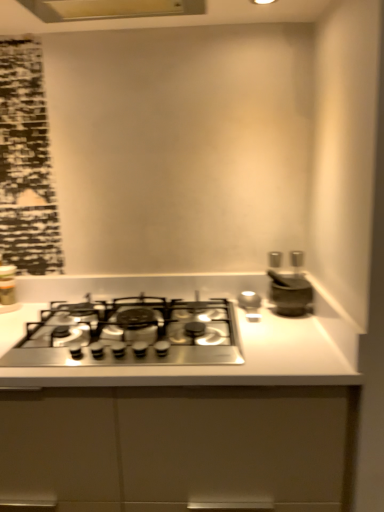
Describe the element at coordinates (110, 9) in the screenshot. I see `matte white exhaust hood at upper center` at that location.

This screenshot has height=512, width=384. What do you see at coordinates (130, 334) in the screenshot? I see `stainless steel gas stove at center` at bounding box center [130, 334].

Image resolution: width=384 pixels, height=512 pixels. What do you see at coordinates (291, 289) in the screenshot?
I see `satin silver mortar at right` at bounding box center [291, 289].

You are a GUI agent. You are given a task and a screenshot of the screen. Output one action in this format:
    pyautogui.click(x=<x>, y=<y>)
    Task: Click on the matte white exhaust hood at upper center
    
    Given the screenshot: What is the action you would take?
    pyautogui.click(x=110, y=9)

Is metallic silver canister at left wider or thinner than satin silver mortar at right?

metallic silver canister at left is thinner than satin silver mortar at right.

Which object is more forward, metallic silver canister at left or satin silver mortar at right?

satin silver mortar at right is closer to the camera.

Would you say metallic silver canister at left contains satin silver mortar at right?

No, satin silver mortar at right is not inside metallic silver canister at left.

Can you tell me how much metallic silver canister at left and satin silver mortar at right differ in facing direction?

The facing directions of metallic silver canister at left and satin silver mortar at right are 0.0382 degrees apart.

Is metallic silver canister at left with matte white exhaust hood at upper center?

They are not placed beside each other.

Can you tell me how much metallic silver canister at left and matte white exhaust hood at upper center differ in facing direction?

0.624 degrees.

Considering the relative sizes of metallic silver canister at left and matte white exhaust hood at upper center in the image provided, is metallic silver canister at left thinner than matte white exhaust hood at upper center?

Yes, metallic silver canister at left is thinner than matte white exhaust hood at upper center.

Is stainless steel gas stove at center in contact with matte white exhaust hood at upper center?

stainless steel gas stove at center is not next to matte white exhaust hood at upper center, and they're not touching.

Is matte white exhaust hood at upper center surrounded by stainless steel gas stove at center?

No, matte white exhaust hood at upper center is not a part of stainless steel gas stove at center.

How distant is stainless steel gas stove at center from matte white exhaust hood at upper center?

A distance of 3.43 feet exists between stainless steel gas stove at center and matte white exhaust hood at upper center.

From a real-world perspective, is stainless steel gas stove at center located beneath matte white exhaust hood at upper center?

Yes, from a real-world perspective, stainless steel gas stove at center is below matte white exhaust hood at upper center.

Does matte white exhaust hood at upper center have a lesser width compared to satin silver mortar at right?

No.

Which is behind, point (179, 6) or point (311, 301)?

The point (179, 6) is farther.

From the image's perspective, is matte white exhaust hood at upper center on satin silver mortar at right?

Correct, matte white exhaust hood at upper center appears higher than satin silver mortar at right in the image.

The height and width of the screenshot is (512, 384). Identify the location of exhaust hood located in front of the satin silver mortar at right. (110, 9).

Based on the photo, between stainless steel gas stove at center and metallic silver canister at left, which one has smaller size?

With smaller size is metallic silver canister at left.

Who is more distant, stainless steel gas stove at center or metallic silver canister at left?

metallic silver canister at left.

Which object is positioned more to the right, stainless steel gas stove at center or metallic silver canister at left?

stainless steel gas stove at center.

Consider the image. From a real-world perspective, which is physically above, stainless steel gas stove at center or metallic silver canister at left?

metallic silver canister at left is physically above.

Is satin silver mortar at right facing towards matte white exhaust hood at upper center?

No, satin silver mortar at right is not aimed at matte white exhaust hood at upper center.

Relative to matte white exhaust hood at upper center, is satin silver mortar at right in front or behind?

Visually, satin silver mortar at right is located behind matte white exhaust hood at upper center.

Identify the location of appliance located behind the matte white exhaust hood at upper center. This screenshot has height=512, width=384. (291, 289).

From a real-world perspective, which object stands above the other?

From a 3D spatial view, satin silver mortar at right is above.

Which of these two, satin silver mortar at right or stainless steel gas stove at center, stands taller?

Standing taller between the two is satin silver mortar at right.

Which is more to the left, satin silver mortar at right or stainless steel gas stove at center?

Positioned to the left is stainless steel gas stove at center.

You are a GUI agent. You are given a task and a screenshot of the screen. Output one action in this format:
    pyautogui.click(x=<x>, y=<y>)
    Task: Click on the appliance that is on the right side of metallic silver canister at left
    This screenshot has height=512, width=384.
    Given the screenshot: What is the action you would take?
    pyautogui.click(x=291, y=289)

Identify the location of kitchen appliance located below the matte white exhaust hood at upper center (from the image's perspective). (7, 285).

When comparing their distances from metallic silver canister at left, does satin silver mortar at right or stainless steel gas stove at center seem further?

The object further to metallic silver canister at left is satin silver mortar at right.

When comparing their distances from matte white exhaust hood at upper center, does satin silver mortar at right or metallic silver canister at left seem closer?

Based on the image, metallic silver canister at left appears to be nearer to matte white exhaust hood at upper center.

Considering their positions, is stainless steel gas stove at center positioned closer to satin silver mortar at right than matte white exhaust hood at upper center?

Among the two, stainless steel gas stove at center is located nearer to satin silver mortar at right.

From the image, which object appears to be farther from matte white exhaust hood at upper center, satin silver mortar at right or stainless steel gas stove at center?

stainless steel gas stove at center.

Estimate the real-world distances between objects in this image. Which object is closer to matte white exhaust hood at upper center, stainless steel gas stove at center or satin silver mortar at right?

Among the two, satin silver mortar at right is located nearer to matte white exhaust hood at upper center.

Looking at the image, which one is located closer to matte white exhaust hood at upper center, metallic silver canister at left or satin silver mortar at right?

metallic silver canister at left is closer to matte white exhaust hood at upper center.

Based on their spatial positions, is stainless steel gas stove at center or metallic silver canister at left closer to matte white exhaust hood at upper center?

metallic silver canister at left is positioned closer to the anchor matte white exhaust hood at upper center.

Looking at the image, which one is located further to stainless steel gas stove at center, satin silver mortar at right or metallic silver canister at left?

metallic silver canister at left lies further to stainless steel gas stove at center than the other object.

This screenshot has width=384, height=512. I want to click on appliance between matte white exhaust hood at upper center and stainless steel gas stove at center in the vertical direction, so click(291, 289).

Identify the location of kitchen appliance between matte white exhaust hood at upper center and stainless steel gas stove at center in the up-down direction. This screenshot has width=384, height=512. (7, 285).

Identify the location of exhaust hood located between metallic silver canister at left and satin silver mortar at right in the left-right direction. This screenshot has width=384, height=512. (110, 9).

Identify the location of gas stove between metallic silver canister at left and satin silver mortar at right. (130, 334).